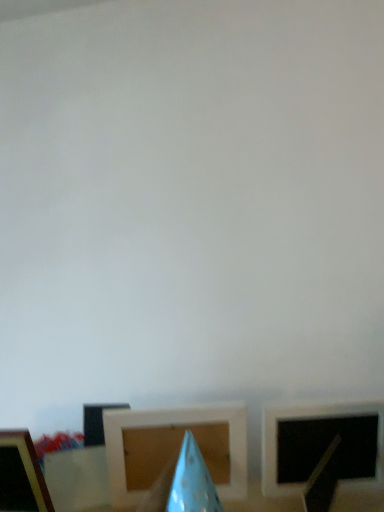
Image resolution: width=384 pixels, height=512 pixels. What do you see at coordinates (322, 445) in the screenshot?
I see `matte white picture frame at right, which is counted as the 3th picture frame, starting from the left` at bounding box center [322, 445].

At what (x,y) coordinates should I click in order to perform the action: click on blue paper cone at center. Please return your answer as a coordinate pair (x, y). Looking at the image, I should click on (192, 481).

Considering the positions of point (5, 493) and point (182, 499), is point (5, 493) closer or farther from the camera than point (182, 499)?

Point (5, 493) is farther from the camera than point (182, 499).

Considering the sizes of objects wooden picture frame at lower left, the first picture frame in the left-to-right sequence, and blue paper cone at center in the image provided, who is taller, wooden picture frame at lower left, the first picture frame in the left-to-right sequence, or blue paper cone at center?

wooden picture frame at lower left, the first picture frame in the left-to-right sequence, is taller.

This screenshot has width=384, height=512. In order to click on exhaust hood in front of the wooden picture frame at lower left, the 3th picture frame from the right in this screenshot , I will do `click(192, 481)`.

From the wooden picture frame at lower left, the 3th picture frame from the right, count 1st picture frames backward and point to it. Please provide its 2D coordinates.

[(322, 445)]

Is wooden picture frame at lower left, the first picture frame in the left-to-right sequence, positioned beyond the bounds of matte white picture frame at right, which is counted as the 3th picture frame, starting from the left?

That's correct, wooden picture frame at lower left, the first picture frame in the left-to-right sequence, is outside of matte white picture frame at right, which is counted as the 3th picture frame, starting from the left.

Considering the positions of points (11, 472) and (321, 443), is point (11, 472) farther from camera compared to point (321, 443)?

No, it is not.

Are matte white picture frame at right, which is the first picture frame from right to left, and blue paper cone at center making contact?

No, matte white picture frame at right, which is the first picture frame from right to left, is not next to blue paper cone at center.

From a real-world perspective, is matte white picture frame at right, which is the first picture frame from right to left, under blue paper cone at center?

Yes.

In the scene shown: Is matte white picture frame at right, which is the first picture frame from right to left, positioned before blue paper cone at center?

No, matte white picture frame at right, which is the first picture frame from right to left, is behind blue paper cone at center.

From the picture: Does matte white picture frame at right, which is counted as the 3th picture frame, starting from the left, turn towards blue paper cone at center?

No, matte white picture frame at right, which is counted as the 3th picture frame, starting from the left, is not aimed at blue paper cone at center.

Are wooden picture frame at lower left, the 3th picture frame from the right, and wooden at center, acting as the second picture frame starting from the left, beside each other?

wooden picture frame at lower left, the 3th picture frame from the right, and wooden at center, acting as the second picture frame starting from the left, are not in contact.

Considering the sizes of objects wooden picture frame at lower left, the 3th picture frame from the right, and wooden at center, acting as the second picture frame starting from the right, in the image provided, who is wider, wooden picture frame at lower left, the 3th picture frame from the right, or wooden at center, acting as the second picture frame starting from the right,?

wooden picture frame at lower left, the 3th picture frame from the right, is wider.

Which object is further away from the camera taking this photo, wooden picture frame at lower left, the first picture frame in the left-to-right sequence, or wooden at center, acting as the second picture frame starting from the right?

wooden at center, acting as the second picture frame starting from the right, is further from the camera.

Find the location of a particular element. This screenshot has width=384, height=512. the 2nd picture frame located beneath the wooden picture frame at lower left, the 3th picture frame from the right (from a real-world perspective) is located at coordinates (174, 447).

Visually, is wooden at center, acting as the second picture frame starting from the right, positioned to the left or to the right of matte white picture frame at right, which is the first picture frame from right to left?

wooden at center, acting as the second picture frame starting from the right, is to the left of matte white picture frame at right, which is the first picture frame from right to left.

From a real-world perspective, which object rests below the other?

wooden at center, acting as the second picture frame starting from the left, from a real-world perspective.

Is wooden at center, acting as the second picture frame starting from the left, aimed at matte white picture frame at right, which is counted as the 3th picture frame, starting from the left?

No.

Relative to matte white picture frame at right, which is counted as the 3th picture frame, starting from the left, is wooden at center, acting as the second picture frame starting from the left, in front or behind?

In the image, wooden at center, acting as the second picture frame starting from the left, appears behind matte white picture frame at right, which is counted as the 3th picture frame, starting from the left.

Measure the distance from blue paper cone at center to matte white picture frame at right, which is counted as the 3th picture frame, starting from the left.

blue paper cone at center is 7.72 inches away from matte white picture frame at right, which is counted as the 3th picture frame, starting from the left.

Looking at this image, which is correct: blue paper cone at center is inside matte white picture frame at right, which is counted as the 3th picture frame, starting from the left, or outside of it?

blue paper cone at center is spatially situated outside matte white picture frame at right, which is counted as the 3th picture frame, starting from the left.

Would you say blue paper cone at center is to the left or to the right of matte white picture frame at right, which is the first picture frame from right to left, in the picture?

From the image, it's evident that blue paper cone at center is to the left of matte white picture frame at right, which is the first picture frame from right to left.

From the image's perspective, which object appears higher, blue paper cone at center or matte white picture frame at right, which is the first picture frame from right to left?

blue paper cone at center is shown above in the image.

From a real-world perspective, is matte white picture frame at right, which is counted as the 3th picture frame, starting from the left, above or below wooden at center, acting as the second picture frame starting from the left?

Clearly, from a real-world perspective, matte white picture frame at right, which is counted as the 3th picture frame, starting from the left, is above wooden at center, acting as the second picture frame starting from the left.

Is matte white picture frame at right, which is counted as the 3th picture frame, starting from the left, inside or outside of wooden at center, acting as the second picture frame starting from the right?

matte white picture frame at right, which is counted as the 3th picture frame, starting from the left, is not inside wooden at center, acting as the second picture frame starting from the right, it's outside.

Based on the photo, what's the angular difference between matte white picture frame at right, which is counted as the 3th picture frame, starting from the left, and wooden at center, acting as the second picture frame starting from the left,'s facing directions?

9.5 degrees.

This screenshot has height=512, width=384. I want to click on the 1st picture frame in front of the wooden at center, acting as the second picture frame starting from the left, so click(x=322, y=445).

Identify the location of exhaust hood above the wooden picture frame at lower left, the 3th picture frame from the right (from the image's perspective). (192, 481).

Locate an element on the screen. Image resolution: width=384 pixels, height=512 pixels. the 2nd picture frame to the right of the wooden picture frame at lower left, the 3th picture frame from the right, counting from the anchor's position is located at coordinates (322, 445).

Based on their spatial positions, is wooden picture frame at lower left, the first picture frame in the left-to-right sequence, or blue paper cone at center further from matte white picture frame at right, which is counted as the 3th picture frame, starting from the left?

Among the two, wooden picture frame at lower left, the first picture frame in the left-to-right sequence, is located further to matte white picture frame at right, which is counted as the 3th picture frame, starting from the left.

Considering their positions, is matte white picture frame at right, which is counted as the 3th picture frame, starting from the left, positioned closer to wooden picture frame at lower left, the first picture frame in the left-to-right sequence, than wooden at center, acting as the second picture frame starting from the right?

Based on the image, wooden at center, acting as the second picture frame starting from the right, appears to be nearer to wooden picture frame at lower left, the first picture frame in the left-to-right sequence.

When comparing their distances from blue paper cone at center, does wooden at center, acting as the second picture frame starting from the right, or matte white picture frame at right, which is counted as the 3th picture frame, starting from the left, seem further?

Based on the image, matte white picture frame at right, which is counted as the 3th picture frame, starting from the left, appears to be further to blue paper cone at center.

From the image, which object appears to be nearer to wooden at center, acting as the second picture frame starting from the left, blue paper cone at center or matte white picture frame at right, which is the first picture frame from right to left?

blue paper cone at center is positioned closer to the anchor wooden at center, acting as the second picture frame starting from the left.

Considering their positions, is matte white picture frame at right, which is the first picture frame from right to left, positioned further to blue paper cone at center than wooden at center, acting as the second picture frame starting from the right?

matte white picture frame at right, which is the first picture frame from right to left, is further to blue paper cone at center.

Looking at the image, which one is located further to wooden at center, acting as the second picture frame starting from the right, blue paper cone at center or wooden picture frame at lower left, the first picture frame in the left-to-right sequence?

Among the two, wooden picture frame at lower left, the first picture frame in the left-to-right sequence, is located further to wooden at center, acting as the second picture frame starting from the right.

Based on their spatial positions, is matte white picture frame at right, which is the first picture frame from right to left, or blue paper cone at center closer to wooden picture frame at lower left, the 3th picture frame from the right?

blue paper cone at center is positioned closer to the anchor wooden picture frame at lower left, the 3th picture frame from the right.

Looking at the image, which one is located further to blue paper cone at center, matte white picture frame at right, which is counted as the 3th picture frame, starting from the left, or wooden picture frame at lower left, the first picture frame in the left-to-right sequence?

The object further to blue paper cone at center is wooden picture frame at lower left, the first picture frame in the left-to-right sequence.

At what (x,y) coordinates should I click in order to perform the action: click on exhaust hood situated between wooden picture frame at lower left, the first picture frame in the left-to-right sequence, and matte white picture frame at right, which is counted as the 3th picture frame, starting from the left, from left to right. Please return your answer as a coordinate pair (x, y). The width and height of the screenshot is (384, 512). Looking at the image, I should click on (192, 481).

Locate an element on the screen. The image size is (384, 512). picture frame situated between wooden picture frame at lower left, the 3th picture frame from the right, and blue paper cone at center from left to right is located at coordinates (174, 447).

Where is `picture frame between wooden picture frame at lower left, the first picture frame in the left-to-right sequence, and matte white picture frame at right, which is the first picture frame from right to left`? picture frame between wooden picture frame at lower left, the first picture frame in the left-to-right sequence, and matte white picture frame at right, which is the first picture frame from right to left is located at coordinates (174, 447).

In order to click on exhaust hood situated between wooden at center, acting as the second picture frame starting from the right, and matte white picture frame at right, which is counted as the 3th picture frame, starting from the left, from left to right in this screenshot , I will do `click(192, 481)`.